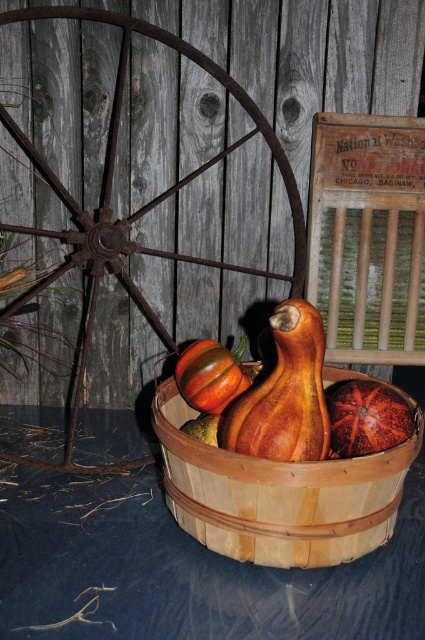
Which of these two, wooden gourd at center or shiny orange pumpkin at center, stands shorter?

With less height is shiny orange pumpkin at center.

Does wooden gourd at center have a greater width compared to shiny orange pumpkin at center?

Indeed, wooden gourd at center has a greater width compared to shiny orange pumpkin at center.

At what (x,y) coordinates should I click in order to perform the action: click on wooden gourd at center. Please return your answer as a coordinate pair (x, y). This screenshot has height=640, width=425. Looking at the image, I should click on (285, 394).

Is orange textured pumpkin at center wider than green matte gourd at center?

Yes, orange textured pumpkin at center is wider than green matte gourd at center.

Does point (401, 426) come closer to viewer compared to point (215, 422)?

Yes, point (401, 426) is closer to viewer.

I want to click on orange textured pumpkin at center, so click(x=368, y=419).

Does point (28, 291) lie behind point (302, 348)?

Yes, it is.

Where is `rusty metal wagon wheel at left`? rusty metal wagon wheel at left is located at coordinates (138, 209).